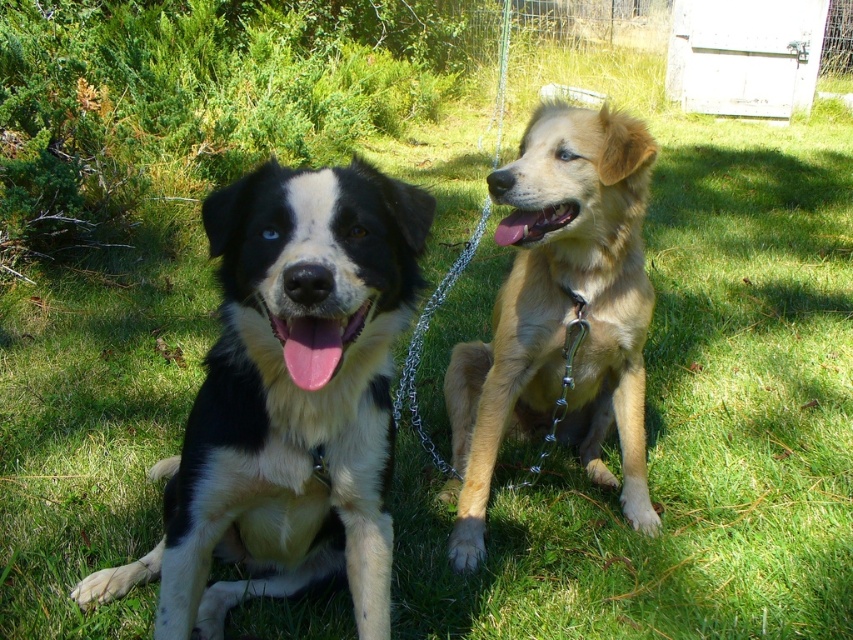
Consider the image. Does black and white fur dog at left come in front of golden fur dog at right?

Yes, it is.

Can you confirm if black and white fur dog at left is wider than golden fur dog at right?

Yes.

Which is in front, point (251, 506) or point (596, 392)?

Positioned in front is point (251, 506).

The width and height of the screenshot is (853, 640). I want to click on black and white fur dog at left, so click(289, 401).